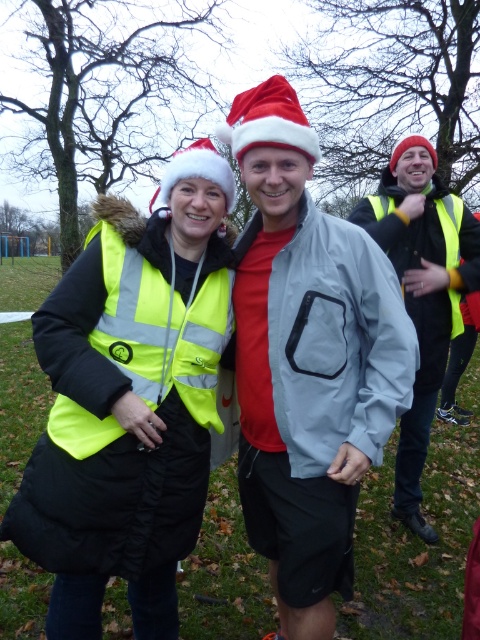
You are a photographer trying to capture the matte gray jacket at center and the matte yellow vest at center in a single shot. Which object should you focus on first if you want to ensure both are in sharp focus?

The matte gray jacket at center is positioned under the matte yellow vest at center, so focusing on the matte yellow vest at center first will help ensure both are in focus since it is closer to the camera.

You are organizing a winter event and need to choose between two vests for visibility. The neon yellow reflective vest at center and the matte yellow vest at center are available. Based on their widths, which vest would you choose for better visibility?

The neon yellow reflective vest at center is narrower than the matte yellow vest at center. However, visibility is more about reflectivity and color rather than width. Since the neon yellow vest has reflective properties, it would be more visible despite its smaller width.